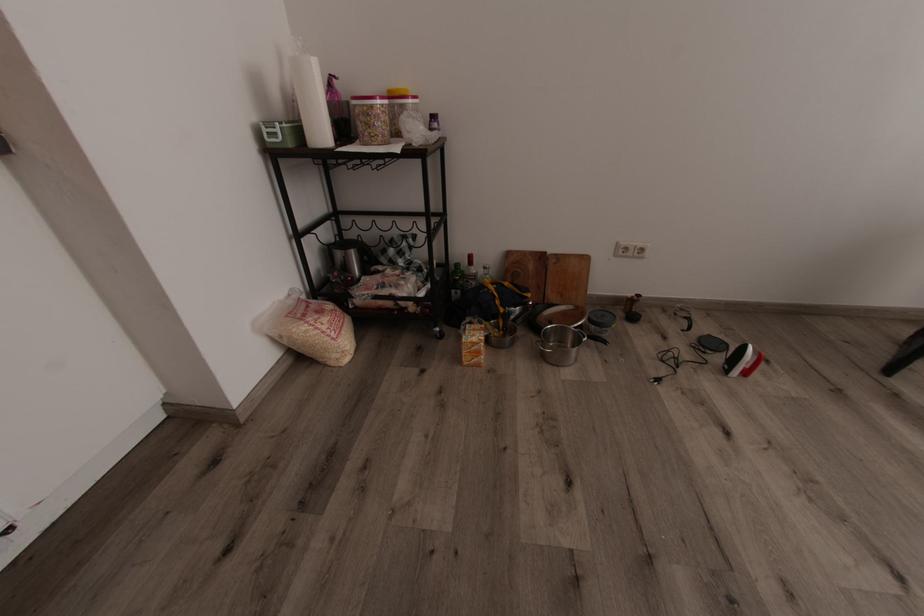
The width and height of the screenshot is (924, 616). I want to click on small white iron, so click(743, 361).